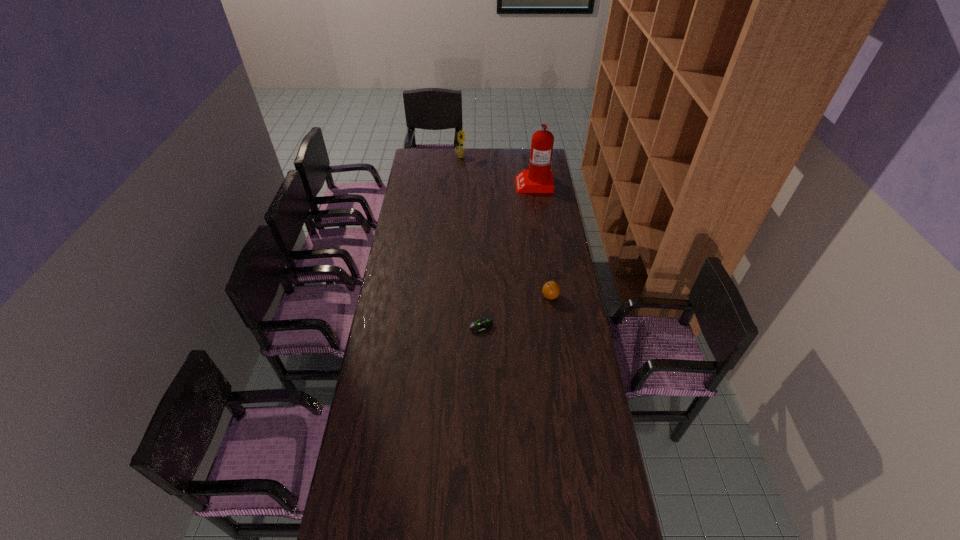
Find the location of `fire extinguisher`. fire extinguisher is located at coordinates (538, 178).

At what (x,y) coordinates should I click in order to perform the action: click on the tallest object. Please return your answer as a coordinate pair (x, y). The image size is (960, 540). Looking at the image, I should click on pyautogui.click(x=538, y=178).

Locate an element on the screen. The image size is (960, 540). sunflower is located at coordinates (460, 150).

Identify the location of the third shortest object. The height and width of the screenshot is (540, 960). (460, 150).

Image resolution: width=960 pixels, height=540 pixels. In order to click on the second shortest object in this screenshot , I will do `click(551, 289)`.

This screenshot has width=960, height=540. What are the coordinates of `the third farthest object` in the screenshot? It's located at (551, 289).

The height and width of the screenshot is (540, 960). Identify the location of the third object from right to left. (480, 326).

Locate an element on the screen. Image resolution: width=960 pixels, height=540 pixels. the shortest object is located at coordinates (480, 326).

Where is `blank area located on the front-facing side of the fire extinguisher`? This screenshot has width=960, height=540. blank area located on the front-facing side of the fire extinguisher is located at coordinates (452, 184).

Where is `vacant space situated on the front-facing side of the fire extinguisher`? vacant space situated on the front-facing side of the fire extinguisher is located at coordinates (466, 184).